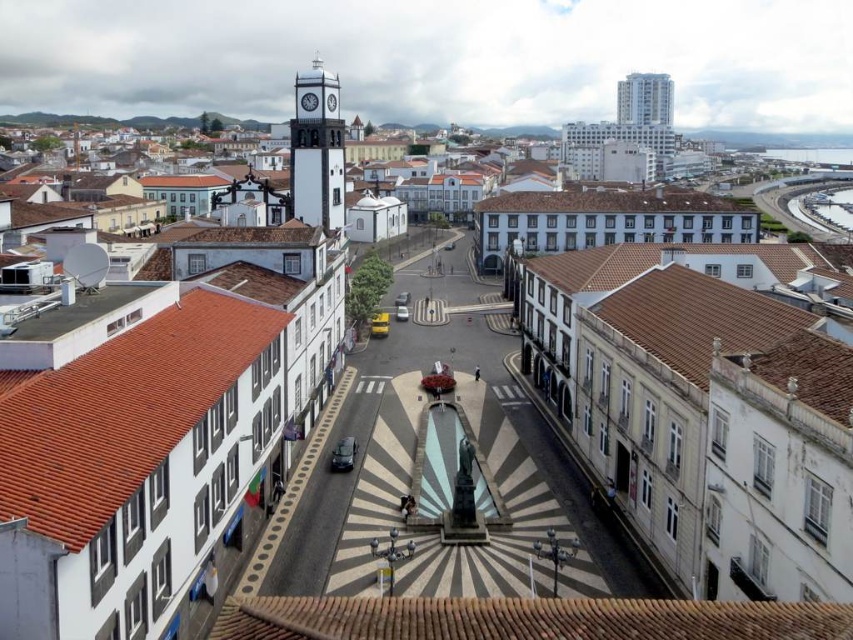
Question: In this image, where is white painted metal clock tower at upper center located relative to white glossy clock tower at upper center?

Choices:
 (A) below
 (B) above

Answer: (A)

Question: Can you confirm if white painted stone clock tower at upper center is wider than white painted metal clock tower at upper center?

Choices:
 (A) yes
 (B) no

Answer: (A)

Question: Which point is closer to the camera?

Choices:
 (A) (317, 72)
 (B) (334, 109)
 (C) (306, 108)

Answer: (A)

Question: Is white painted stone clock tower at upper center thinner than white glossy clock tower at upper center?

Choices:
 (A) yes
 (B) no

Answer: (B)

Question: Among these points, which one is nearest to the camera?

Choices:
 (A) (329, 109)
 (B) (326, 84)

Answer: (B)

Question: Which object appears closest to the camera in this image?

Choices:
 (A) white glossy clock tower at upper center
 (B) white painted metal clock tower at upper center

Answer: (B)